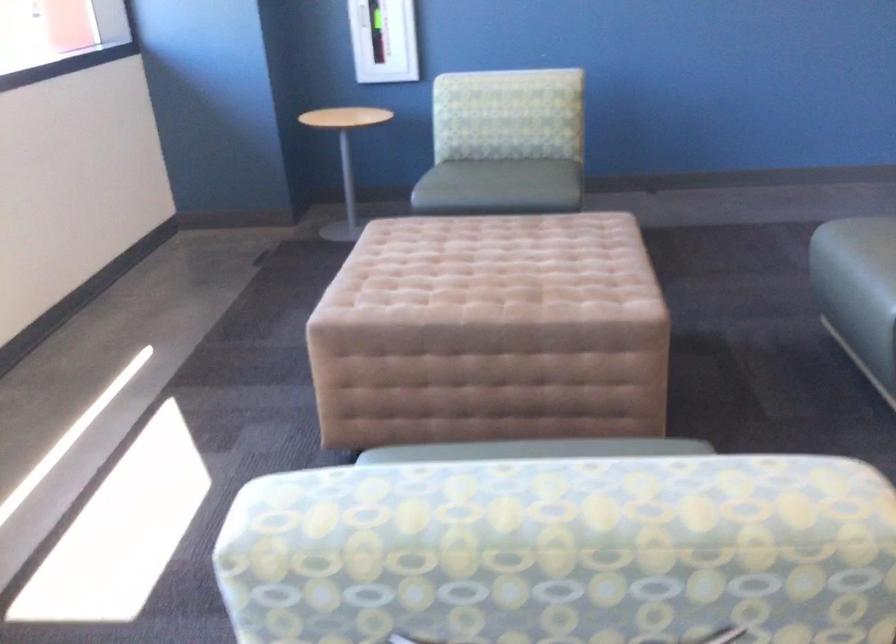
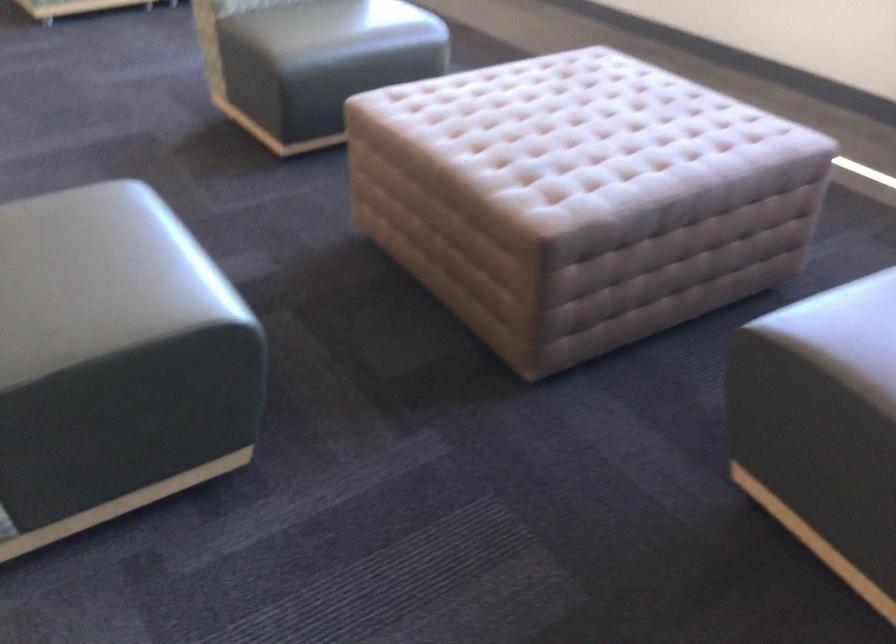
Find the pixel in the second image that matches point 538,232 in the first image.

(586, 147)